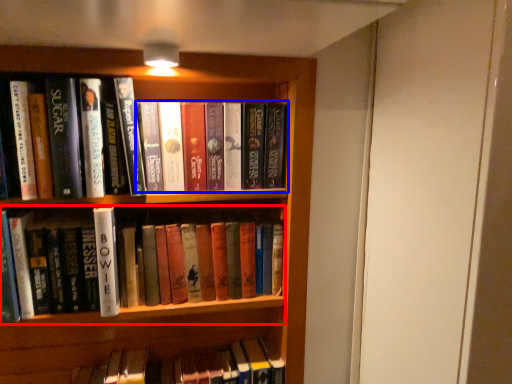
Question: Which of the following is the farthest to the observer, book (highlighted by a red box) or book (highlighted by a blue box)?

Choices:
 (A) book
 (B) book

Answer: (B)